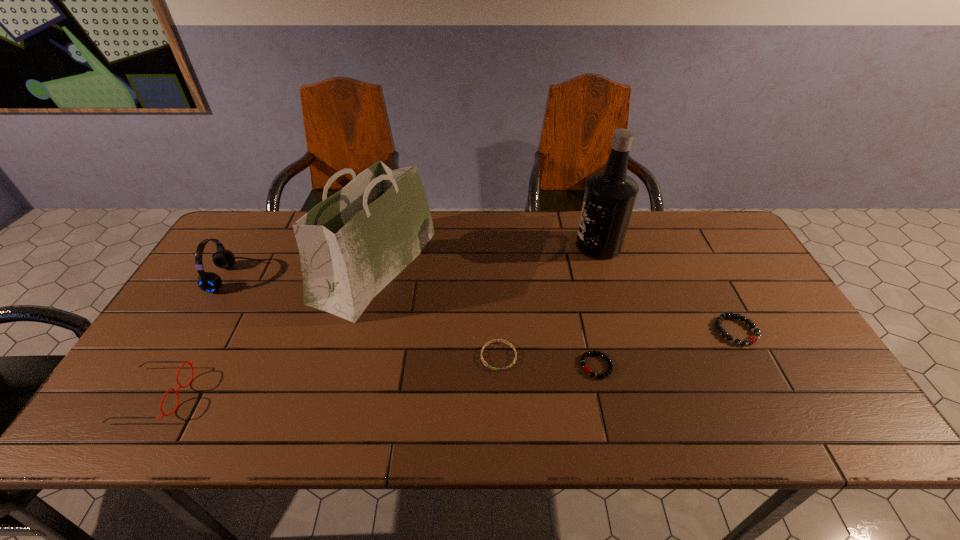
Identify the location of free space located 0.230m on the front label of the tallest object. (503, 245).

The image size is (960, 540). Identify the location of vacant space located on the front label of the tallest object. (556, 245).

At what (x,y) coordinates should I click in order to perform the action: click on vacant position located on the right of the grocery bag. Please return your answer as a coordinate pair (x, y). The width and height of the screenshot is (960, 540). Looking at the image, I should click on (516, 266).

Identify the location of free location located 0.230m on the ear cushions of the headset. This screenshot has height=540, width=960. (335, 278).

Locate an element on the screen. The image size is (960, 540). vacant point located 0.330m on the front-facing side of the fourth tallest object is located at coordinates (326, 395).

Identify the location of free space located 0.110m on the left of the tallest bracelet. The height and width of the screenshot is (540, 960). (674, 330).

I want to click on blank area located 0.050m on the right of the second bracelet from left to right, so 633,366.

Locate an element on the screen. The width and height of the screenshot is (960, 540). vacant space located on the surface of the leftmost bracelet showing star-shaped elements is located at coordinates click(x=501, y=413).

I want to click on liquor that is at the far edge, so click(x=609, y=197).

I want to click on grocery bag located in the far edge section of the desktop, so (353, 244).